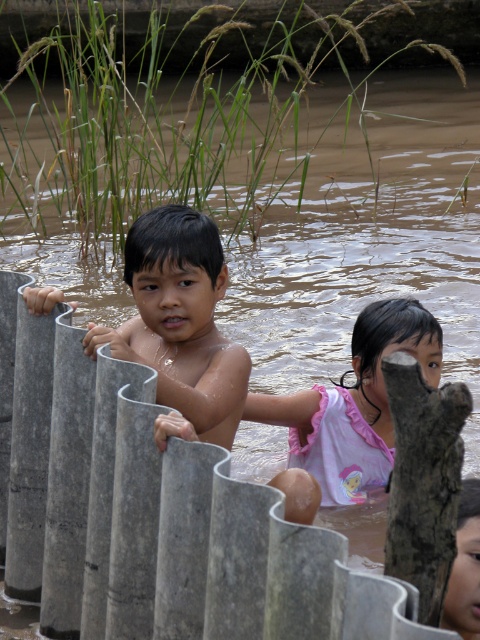
You are a lifeguard observing the scene. The smooth skin boy at center and the pink cotton shirt at center are both in the water. Which object is wider?

The smooth skin boy at center is less than pink cotton shirt at center in width, so the pink cotton shirt at center is wider.

You are a lifeguard and need to locate the smooth skin boy at center in the image. What are the coordinates where you should focus your attention?

The coordinates to focus on are point (180,321).